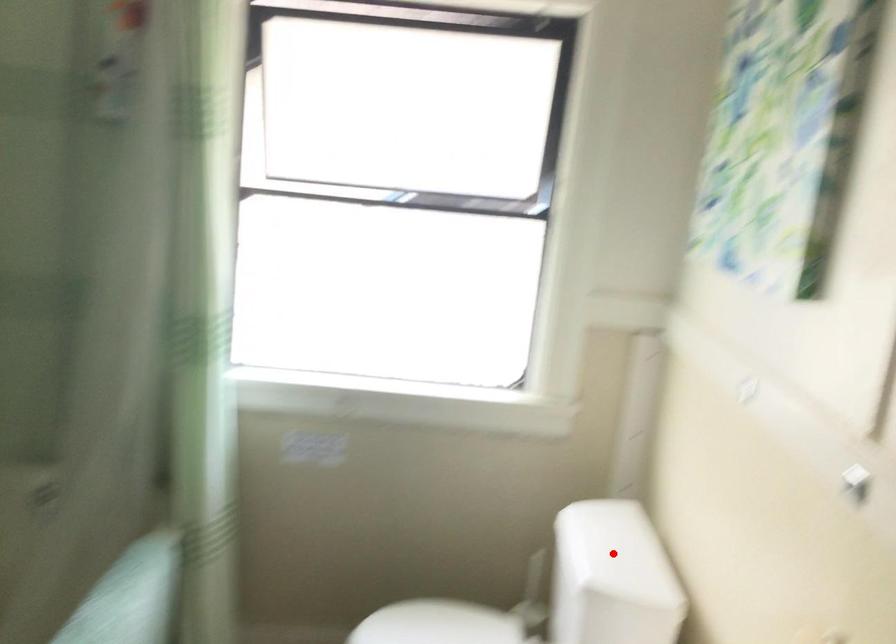
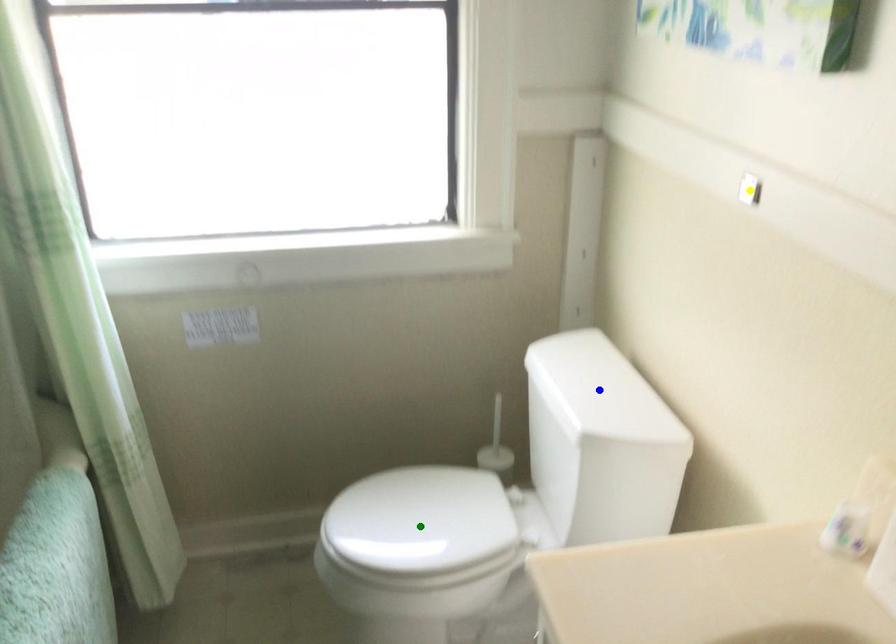
Question: I am providing you with two images of the same scene from different viewpoints. A red point is marked on the first image. You are given multiple points on the second image. In image 2, which mark is for the same physical point as the one in image 1?

Choices:
 (A) green point
 (B) blue point
 (C) yellow point

Answer: (B)